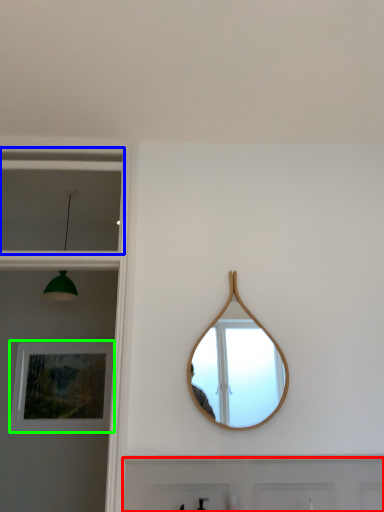
Question: Which object is positioned farthest from door (highlighted by a red box)? Select from window (highlighted by a blue box) and picture frame (highlighted by a green box).

Choices:
 (A) window
 (B) picture frame

Answer: (A)